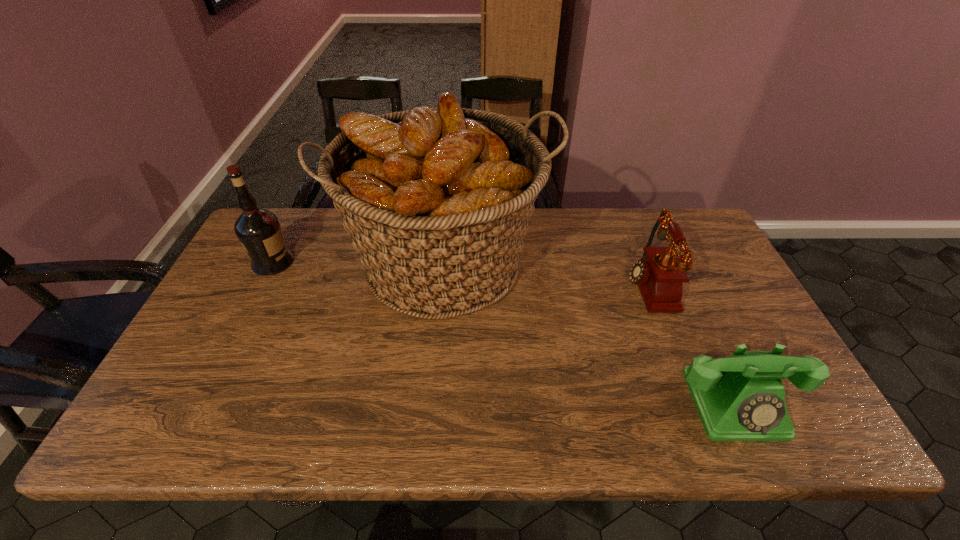
The width and height of the screenshot is (960, 540). I want to click on vacant space at the far edge of the desktop, so click(x=336, y=232).

Image resolution: width=960 pixels, height=540 pixels. In order to click on vacant area at the near edge in this screenshot , I will do `click(733, 444)`.

In the image, there is a desktop. Identify the location of vacant space at the left edge. (206, 333).

Locate an element on the screen. vacant space at the far left corner is located at coordinates (300, 210).

Identify the location of empty location between the taller telephone and the shorter telephone. (690, 344).

Where is `vacant space in between the second object from left to right and the nearer telephone`? The image size is (960, 540). vacant space in between the second object from left to right and the nearer telephone is located at coordinates (591, 333).

Identify the location of vacant region between the shorter telephone and the leftmost object. Image resolution: width=960 pixels, height=540 pixels. click(504, 333).

Locate an element on the screen. Image resolution: width=960 pixels, height=540 pixels. free space between the tallest object and the second shortest object is located at coordinates (547, 274).

What are the coordinates of `free spot between the third object from right to left and the third tallest object` in the screenshot? It's located at (547, 274).

You are a GUI agent. You are given a task and a screenshot of the screen. Output one action in this format:
    pyautogui.click(x=<x>, y=<y>)
    Task: Click on the vacant space that is in between the third tallest object and the tallest object
    This screenshot has height=540, width=960.
    Given the screenshot: What is the action you would take?
    point(547,274)